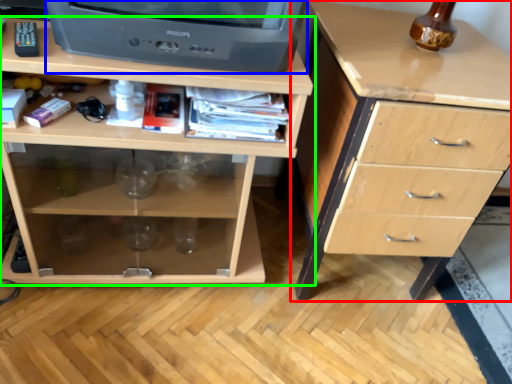
Question: Estimate the real-world distances between objects in this image. Which object is closer to chest of drawers (highlighted by a red box), television (highlighted by a blue box) or chest of drawers (highlighted by a green box)?

Choices:
 (A) television
 (B) chest of drawers

Answer: (B)